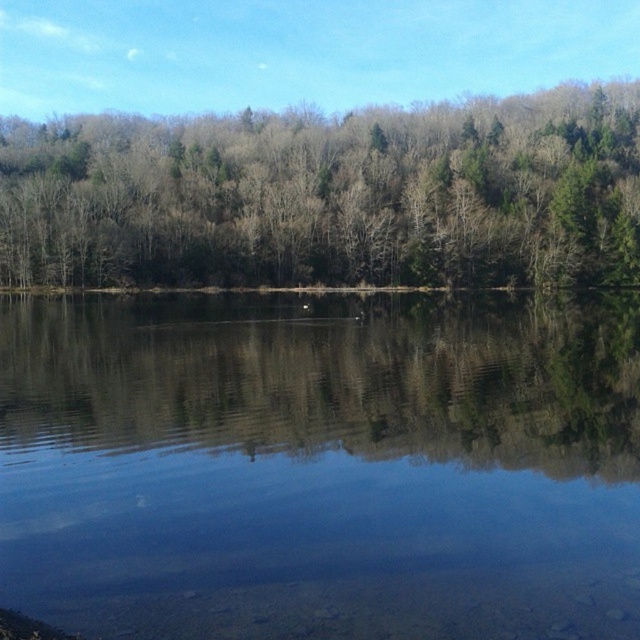
Does clear water at center appear on the left side of green matte trees at center?

Yes, clear water at center is to the left of green matte trees at center.

The image size is (640, 640). Describe the element at coordinates (321, 465) in the screenshot. I see `clear water at center` at that location.

Locate an element on the screen. clear water at center is located at coordinates (x=321, y=465).